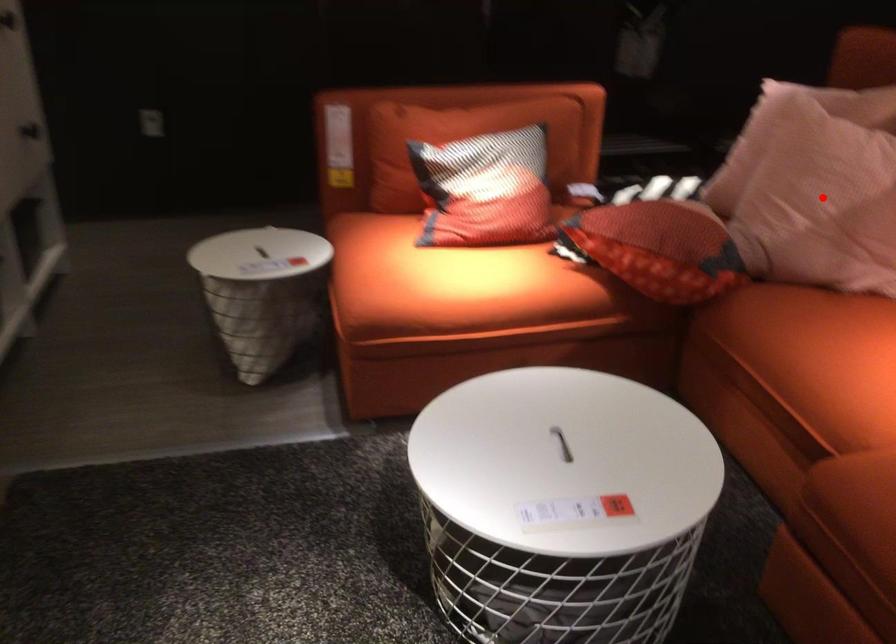
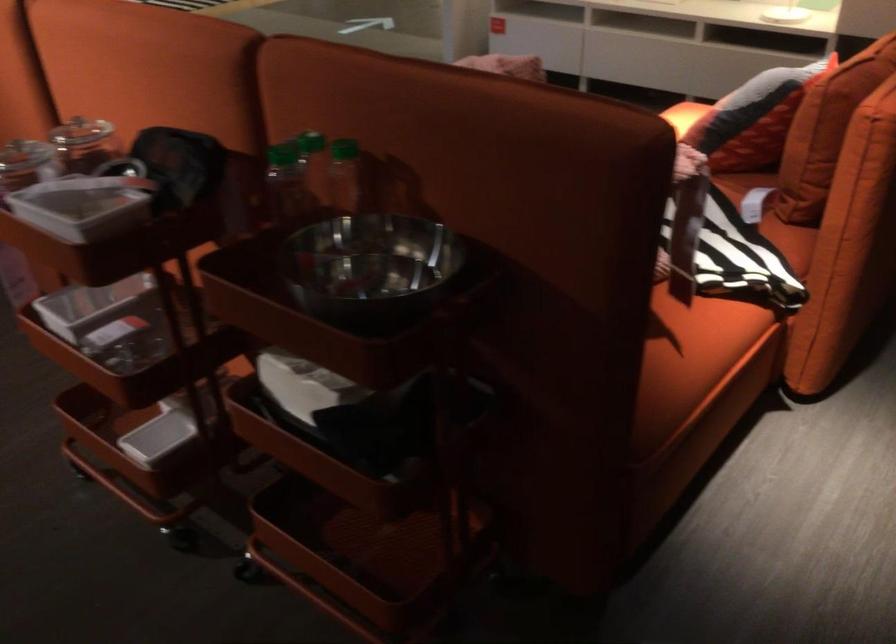
Question: I am providing you with two images of the same scene from different viewpoints. A red point is marked on the first image. Is the red point's position out of view in image 2?

Choices:
 (A) Yes
 (B) No

Answer: (A)